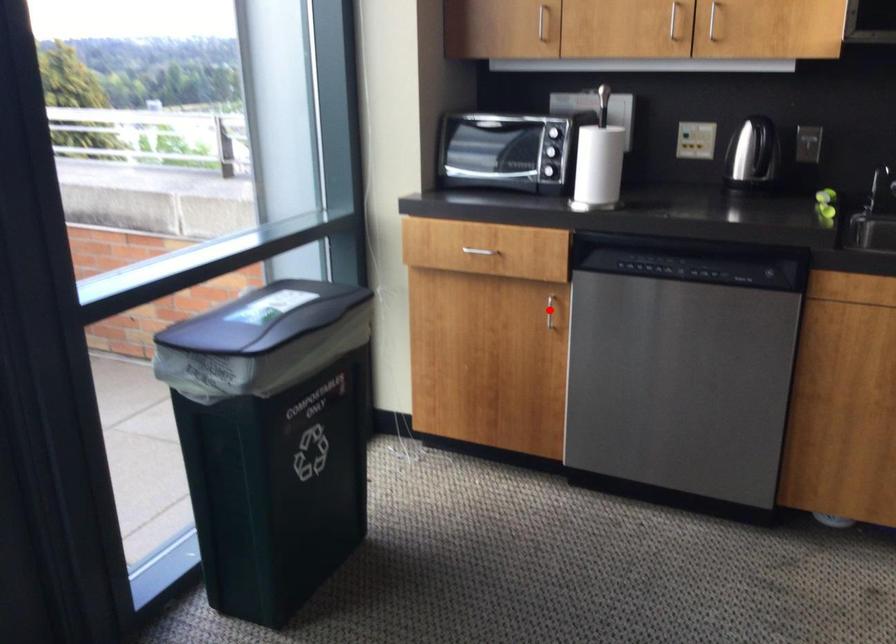
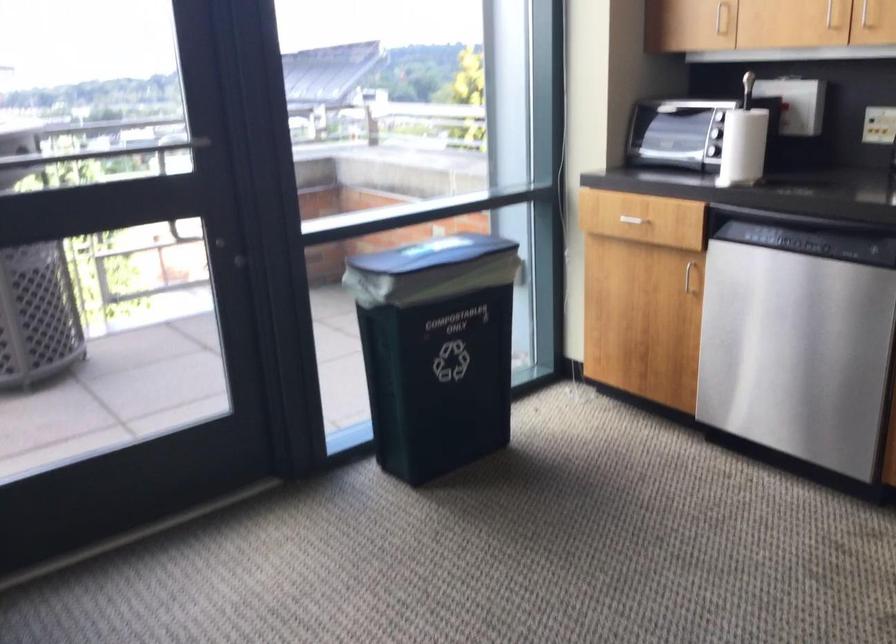
In the second image, find the point that corresponds to the highlighted location in the first image.

(690, 276)